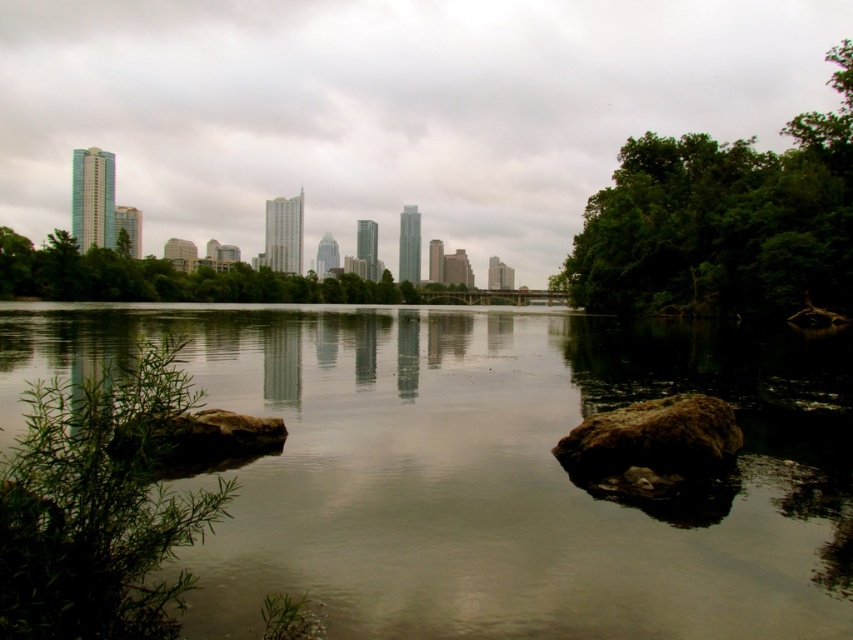
Question: Which of the following is the closest to the observer?

Choices:
 (A) (27, 456)
 (B) (498, 436)

Answer: (A)

Question: Which point appears closest to the camera in this image?

Choices:
 (A) (200, 388)
 (B) (663, 406)
 (C) (351, 291)

Answer: (B)

Question: Is greenish reflective water at center further to camera compared to green leafy trees at right?

Choices:
 (A) no
 (B) yes

Answer: (A)

Question: Which point is farther to the camera?

Choices:
 (A) brown rough rock at lower left
 (B) greenish reflective water at center
 (C) green leafy trees at center
 (D) green leafy plant at left

Answer: (C)

Question: From the image, what is the correct spatial relationship of greenish reflective water at center in relation to brown rough rock at lower left?

Choices:
 (A) above
 (B) below

Answer: (A)

Question: Does green leafy trees at right appear under green leafy plant at left?

Choices:
 (A) no
 (B) yes

Answer: (A)